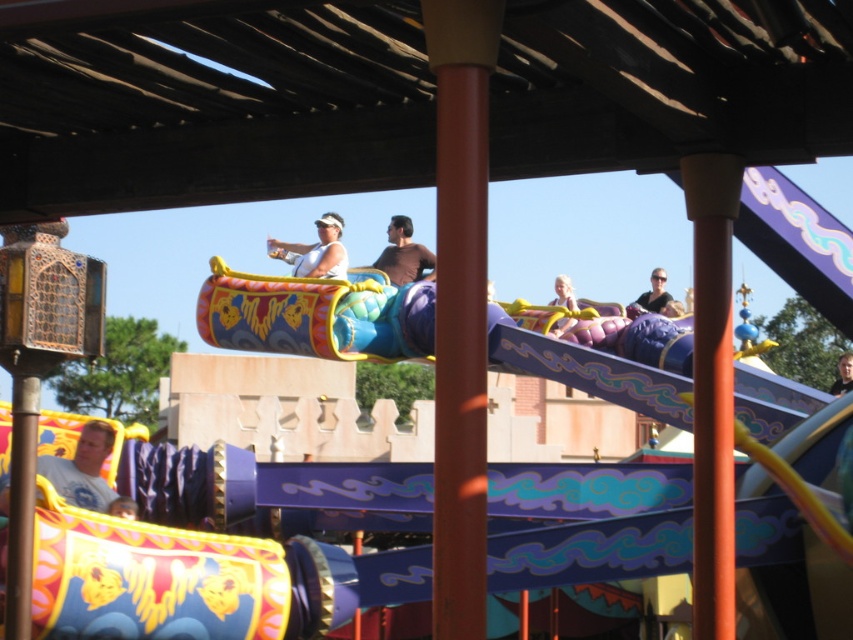
Does white matte tank top at center appear over smooth brown hair at upper center?

Correct, white matte tank top at center is located above smooth brown hair at upper center.

How distant is white matte tank top at center from smooth brown hair at upper center?

They are 121.19 feet apart.

The image size is (853, 640). What are the coordinates of `white matte tank top at center` in the screenshot? It's located at (315, 250).

You are a GUI agent. You are given a task and a screenshot of the screen. Output one action in this format:
    pyautogui.click(x=<x>, y=<y>)
    Task: Click on the white matte tank top at center
    The image size is (853, 640).
    Given the screenshot: What is the action you would take?
    pyautogui.click(x=315, y=250)

Is point (270, 243) positioned after point (656, 282)?

Yes, it is behind point (656, 282).

Who is taller, white matte tank top at center or matte black sunglasses at upper center?

white matte tank top at center

I want to click on white matte tank top at center, so click(315, 250).

Does white cotton shirt at lower left appear over smooth brown hair at upper center?

No, white cotton shirt at lower left is not above smooth brown hair at upper center.

Does point (61, 492) come behind point (839, 390)?

No, it is in front of (839, 390).

The height and width of the screenshot is (640, 853). I want to click on white cotton shirt at lower left, so click(x=82, y=468).